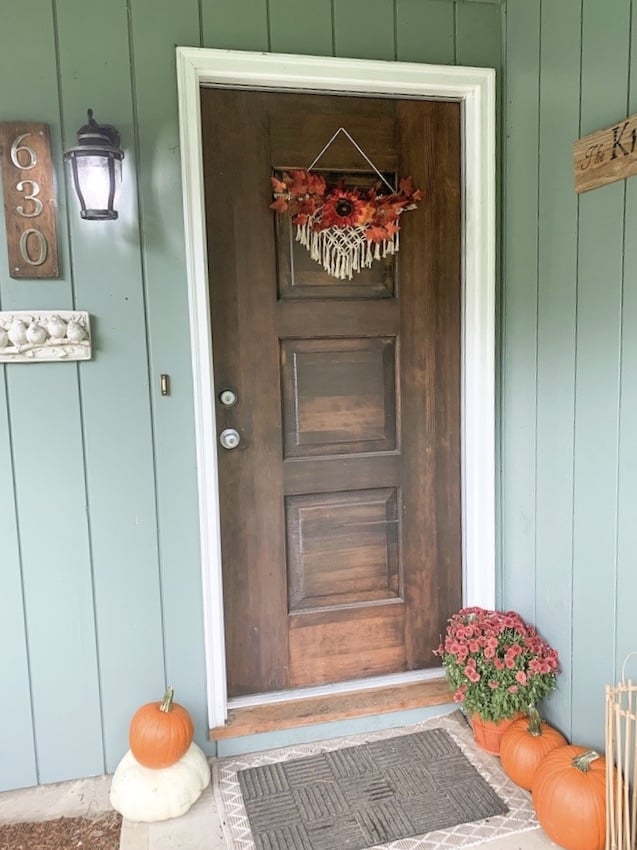
Point to the what is hanging from the door in the image. Your answer should be formatted as a list of tuples, i.e. [(x1, y1), (x2, y2), ...], where each tuple contains the x and y coordinates of a point satisfying the conditions above.

[(355, 225)]